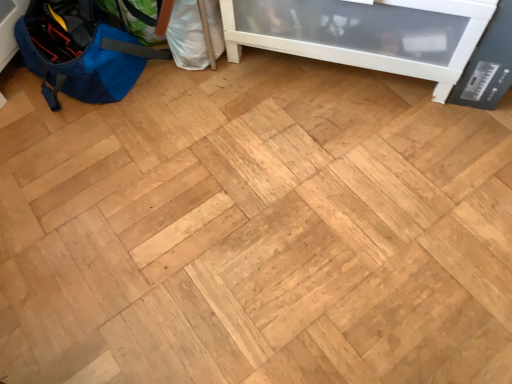
Image resolution: width=512 pixels, height=384 pixels. Describe the element at coordinates (80, 52) in the screenshot. I see `blue fabric backpack at left` at that location.

Find the location of a particular element. The image size is (512, 384). blue fabric backpack at left is located at coordinates (80, 52).

Identify the location of blue fabric backpack at left. (80, 52).